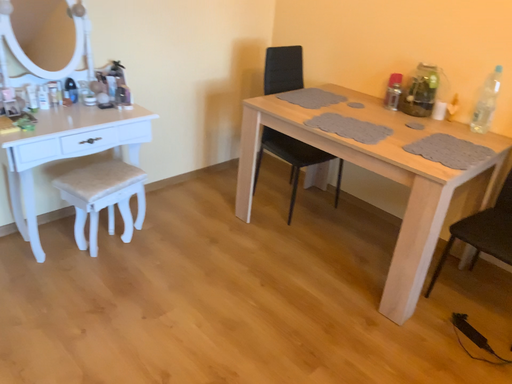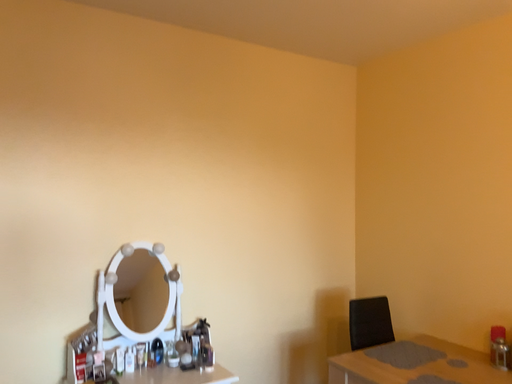
Question: Which way did the camera rotate in the video?

Choices:
 (A) rotated right
 (B) rotated left

Answer: (B)